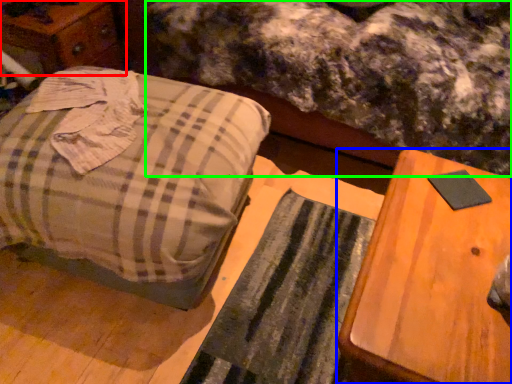
Question: Which is farther away from dresser (highlighted by a red box)? table (highlighted by a blue box) or mattress (highlighted by a green box)?

Choices:
 (A) table
 (B) mattress

Answer: (A)